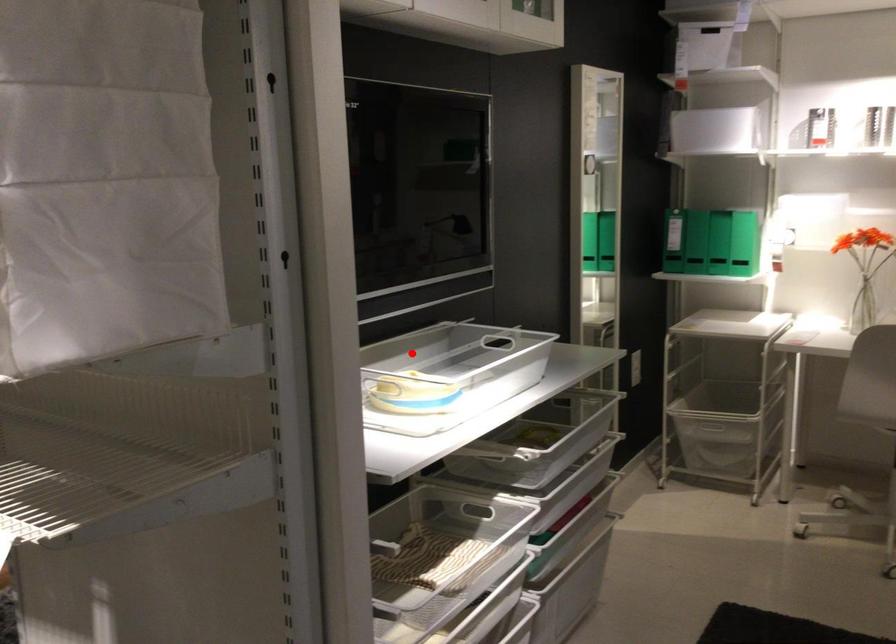
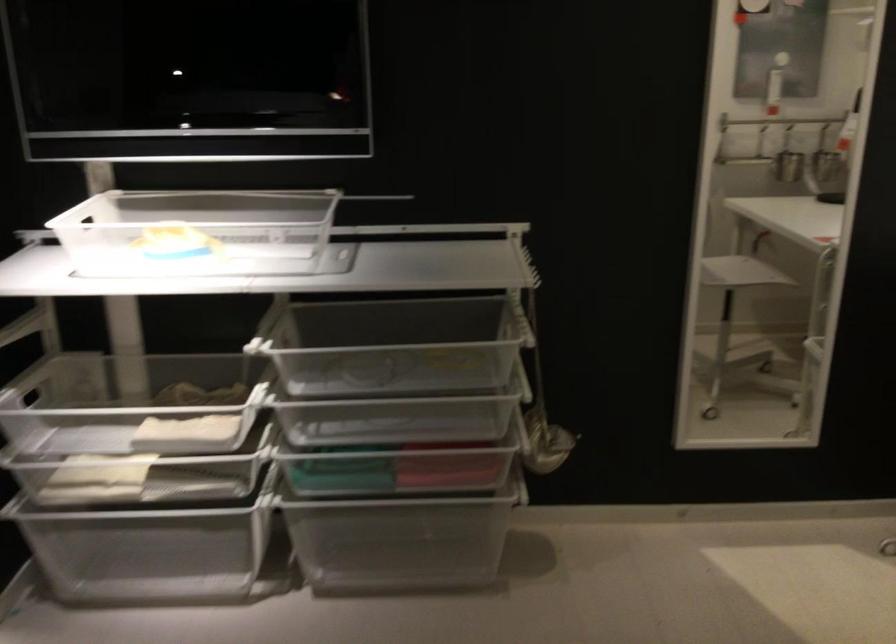
Locate, in the second image, the point that corresponds to the highlighted location in the first image.

(197, 232)